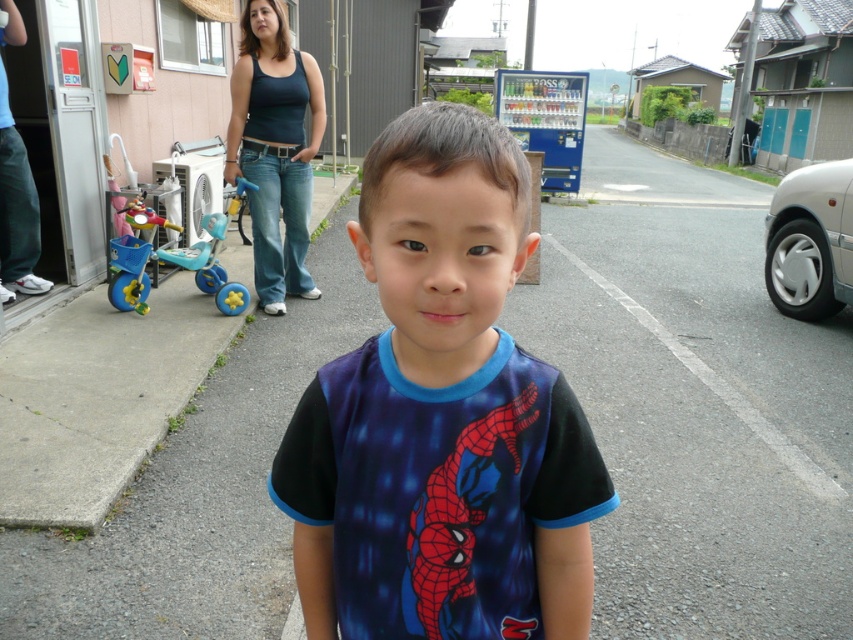
Between blue printed t-shirt at center and black cotton tank top at upper center, which one has less height?

blue printed t-shirt at center

Does blue printed t-shirt at center have a lesser width compared to black cotton tank top at upper center?

Correct, blue printed t-shirt at center's width is less than black cotton tank top at upper center's.

Find the location of a particular element. This screenshot has width=853, height=640. blue printed t-shirt at center is located at coordinates (440, 417).

Between gray asphalt pavement at center and blue printed t-shirt at center, which one is positioned lower?

blue printed t-shirt at center is below.

Can you confirm if gray asphalt pavement at center is positioned below blue printed t-shirt at center?

No, gray asphalt pavement at center is not below blue printed t-shirt at center.

What do you see at coordinates (698, 424) in the screenshot?
I see `gray asphalt pavement at center` at bounding box center [698, 424].

Locate an element on the screen. gray asphalt pavement at center is located at coordinates (698, 424).

Which is more to the left, gray asphalt pavement at center or black cotton tank top at upper center?

black cotton tank top at upper center is more to the left.

Locate an element on the screen. gray asphalt pavement at center is located at coordinates (698, 424).

The height and width of the screenshot is (640, 853). Find the location of `gray asphalt pavement at center`. gray asphalt pavement at center is located at coordinates (698, 424).

The image size is (853, 640). Find the location of `gray asphalt pavement at center`. gray asphalt pavement at center is located at coordinates click(x=698, y=424).